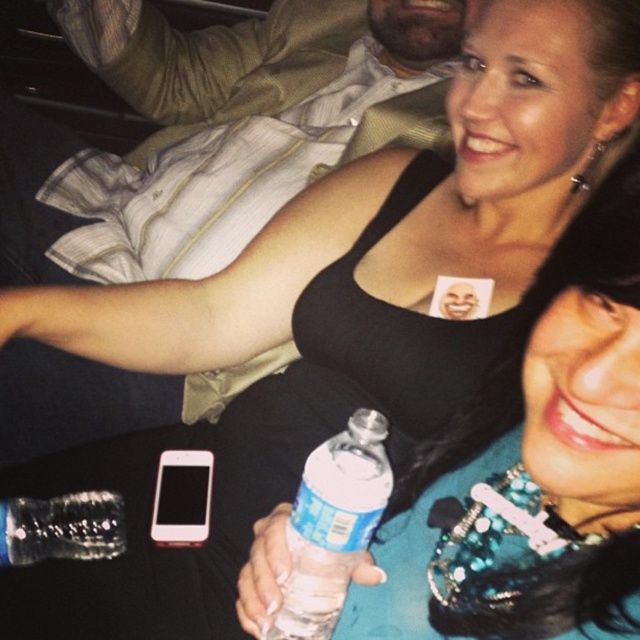
You are a photographer standing at the event. You want to take a photo of the two women while ensuring the clear plastic bottle at center is not in the frame. Can you move closer to them without the bottle entering the frame? The maximum distance you can move closer is 18 inches.

The clear plastic bottle at center is currently 18.98 inches away from the viewer. If you move closer by up to 18 inches, the new distance would be approximately 0.98 inches. Since the bottle is still within the frame, you cannot move closer without the bottle entering the frame.

You are at a social event and need to choose a drink container. You see two clear plastic bottles. The first is the clear plastic bottle at center and the second is the clear plastic bottle at lower center. Which one is taller?

The clear plastic bottle at center is taller than the clear plastic bottle at lower center.